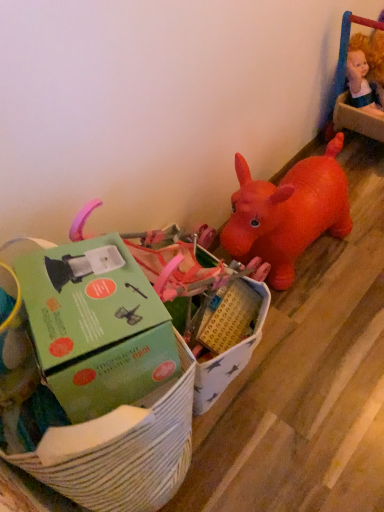
The height and width of the screenshot is (512, 384). Describe the element at coordinates (227, 334) in the screenshot. I see `green cardboard box at center, which is the 1th toy from left to right` at that location.

I want to click on green cardboard box at lower left, so click(x=96, y=326).

Locate an element on the screen. This screenshot has height=512, width=384. green cardboard box at center, the second toy positioned from the back is located at coordinates (227, 334).

Is smooth plastic doll at upper right, the first toy from the back, taller than green cardboard box at center, the 2th toy from the top?

In fact, smooth plastic doll at upper right, the first toy from the back, may be shorter than green cardboard box at center, the 2th toy from the top.

Between smooth plastic doll at upper right, acting as the 1th toy starting from the right, and green cardboard box at center, which is the 1th toy from left to right, which one has smaller size?

Smaller between the two is smooth plastic doll at upper right, acting as the 1th toy starting from the right.

Which is closer to the camera, (345, 31) or (204, 257)?

The point (204, 257) is closer to the camera.

Is smooth plastic doll at upper right, which is the second toy in left-to-right order, next to green cardboard box at center, which is the 1th toy in front-to-back order, and touching it?

No, smooth plastic doll at upper right, which is the second toy in left-to-right order, is not with green cardboard box at center, which is the 1th toy in front-to-back order.

Would you say green cardboard box at lower left is part of green cardboard box at center, which is the 1th toy from left to right,'s contents?

Definitely not — green cardboard box at lower left is not inside green cardboard box at center, which is the 1th toy from left to right.

Identify the location of toy that is the 1st object located behind the green cardboard box at lower left. (227, 334).

Can you tell me how much green cardboard box at center, which is the 1th toy in front-to-back order, and green cardboard box at lower left differ in facing direction?

There is a 25.6-degree angle between the facing directions of green cardboard box at center, which is the 1th toy in front-to-back order, and green cardboard box at lower left.

Could you tell me if green cardboard box at center, the second toy positioned from the back, is turned towards green cardboard box at lower left?

No, green cardboard box at center, the second toy positioned from the back, is not facing towards green cardboard box at lower left.

From the image's perspective, is green cardboard box at lower left located beneath smooth plastic doll at upper right, the first toy from the back?

Correct, green cardboard box at lower left appears lower than smooth plastic doll at upper right, the first toy from the back, in the image.

How distant is green cardboard box at lower left from smooth plastic doll at upper right, which is the 2th toy in front-to-back order?

The distance of green cardboard box at lower left from smooth plastic doll at upper right, which is the 2th toy in front-to-back order, is 4.33 feet.

From their relative heights in the image, would you say green cardboard box at lower left is taller or shorter than smooth plastic doll at upper right, acting as the 1th toy starting from the right?

Considering their sizes, green cardboard box at lower left has less height than smooth plastic doll at upper right, acting as the 1th toy starting from the right.

From a real-world perspective, is green cardboard box at lower left positioned under smooth plastic doll at upper right, placed as the first toy when sorted from top to bottom, based on gravity?

No, from a real-world perspective, green cardboard box at lower left is not beneath smooth plastic doll at upper right, placed as the first toy when sorted from top to bottom.

Is green cardboard box at center, which is the second toy in right-to-left order, positioned far away from smooth plastic doll at upper right, placed as the first toy when sorted from top to bottom?

Yes, green cardboard box at center, which is the second toy in right-to-left order, and smooth plastic doll at upper right, placed as the first toy when sorted from top to bottom, are located far from each other.

Relative to smooth plastic doll at upper right, the first toy from the back, is green cardboard box at center, which is the second toy in right-to-left order, in front or behind?

Clearly, green cardboard box at center, which is the second toy in right-to-left order, is in front of smooth plastic doll at upper right, the first toy from the back.

Is smooth plastic doll at upper right, acting as the 1th toy starting from the right, a part of green cardboard box at center, the second toy positioned from the back?

No, green cardboard box at center, the second toy positioned from the back, does not contain smooth plastic doll at upper right, acting as the 1th toy starting from the right.

Considering the relative positions of green cardboard box at center, which is the 1th toy in front-to-back order, and smooth plastic doll at upper right, which is the 2th toy in front-to-back order, in the image provided, is green cardboard box at center, which is the 1th toy in front-to-back order, to the left or to the right of smooth plastic doll at upper right, which is the 2th toy in front-to-back order,?

From the image, it's evident that green cardboard box at center, which is the 1th toy in front-to-back order, is to the left of smooth plastic doll at upper right, which is the 2th toy in front-to-back order.

Is green cardboard box at lower left oriented towards green cardboard box at center, which is the 1th toy in front-to-back order?

No, green cardboard box at lower left is not aimed at green cardboard box at center, which is the 1th toy in front-to-back order.

Considering the relative positions of green cardboard box at lower left and green cardboard box at center, which ranks as the first toy in bottom-to-top order, in the image provided, is green cardboard box at lower left to the left of green cardboard box at center, which ranks as the first toy in bottom-to-top order, from the viewer's perspective?

Indeed, green cardboard box at lower left is positioned on the left side of green cardboard box at center, which ranks as the first toy in bottom-to-top order.

Considering the sizes of objects green cardboard box at lower left and green cardboard box at center, which ranks as the first toy in bottom-to-top order, in the image provided, who is bigger, green cardboard box at lower left or green cardboard box at center, which ranks as the first toy in bottom-to-top order,?

Bigger between the two is green cardboard box at center, which ranks as the first toy in bottom-to-top order.

From the image's perspective, is green cardboard box at lower left located above or below green cardboard box at center, which is the 1th toy from left to right?

Based on their image positions, green cardboard box at lower left is located above green cardboard box at center, which is the 1th toy from left to right.

Is smooth plastic doll at upper right, the first toy from the back, smaller than green cardboard box at lower left?

No, smooth plastic doll at upper right, the first toy from the back, is not smaller than green cardboard box at lower left.

Is point (339, 82) farther from camera compared to point (75, 400)?

Yes.

From the image's perspective, is smooth plastic doll at upper right, which is the second toy in bottom-to-top order, positioned above or below green cardboard box at lower left?

smooth plastic doll at upper right, which is the second toy in bottom-to-top order, is above green cardboard box at lower left.

Considering the sizes of objects smooth plastic doll at upper right, which is the second toy in left-to-right order, and green cardboard box at lower left in the image provided, who is taller, smooth plastic doll at upper right, which is the second toy in left-to-right order, or green cardboard box at lower left?

smooth plastic doll at upper right, which is the second toy in left-to-right order, is taller.

At what (x,y) coordinates should I click in order to perform the action: click on toy beneath the smooth plastic doll at upper right, which is the second toy in bottom-to-top order (from a real-world perspective). Please return your answer as a coordinate pair (x, y). This screenshot has height=512, width=384. Looking at the image, I should click on (227, 334).

Locate an element on the screen. The width and height of the screenshot is (384, 512). the 1st toy to the right when counting from the green cardboard box at lower left is located at coordinates (227, 334).

Based on their spatial positions, is smooth plastic doll at upper right, the first toy from the back, or green cardboard box at center, which is the second toy in right-to-left order, further from green cardboard box at lower left?

smooth plastic doll at upper right, the first toy from the back, lies further to green cardboard box at lower left than the other object.

Based on their spatial positions, is smooth plastic doll at upper right, the first toy from the back, or green cardboard box at lower left closer to green cardboard box at center, the 2th toy from the top?

green cardboard box at lower left is positioned closer to the anchor green cardboard box at center, the 2th toy from the top.

Considering their positions, is green cardboard box at lower left positioned further to green cardboard box at center, the second toy positioned from the back, than smooth plastic doll at upper right, which is the second toy in left-to-right order?

Based on the image, smooth plastic doll at upper right, which is the second toy in left-to-right order, appears to be further to green cardboard box at center, the second toy positioned from the back.

Considering their positions, is green cardboard box at center, which is the 1th toy from left to right, positioned further to green cardboard box at lower left than smooth plastic doll at upper right, placed as the first toy when sorted from top to bottom?

smooth plastic doll at upper right, placed as the first toy when sorted from top to bottom.

Consider the image. Estimate the real-world distances between objects in this image. Which object is closer to smooth plastic doll at upper right, which is the 2th toy in front-to-back order, green cardboard box at lower left or green cardboard box at center, which ranks as the first toy in bottom-to-top order?

The object closer to smooth plastic doll at upper right, which is the 2th toy in front-to-back order, is green cardboard box at center, which ranks as the first toy in bottom-to-top order.

Considering their positions, is green cardboard box at center, the 2th toy from the top, positioned closer to smooth plastic doll at upper right, which is the second toy in left-to-right order, than green cardboard box at lower left?

green cardboard box at center, the 2th toy from the top, lies closer to smooth plastic doll at upper right, which is the second toy in left-to-right order, than the other object.

I want to click on box between smooth plastic doll at upper right, which is the second toy in bottom-to-top order, and green cardboard box at center, the 2th toy from the top, vertically, so coord(96,326).